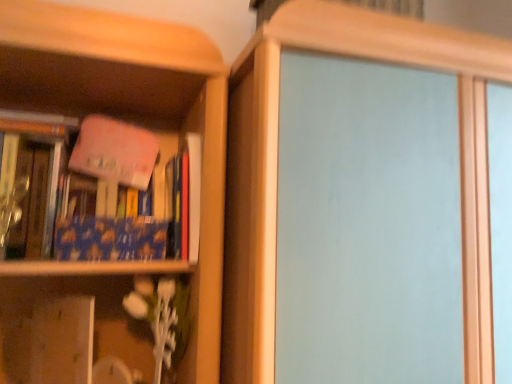
Question: Can we say blue matte book at left, which ranks as the 1th book in left-to-right order, lies outside transparent glass screen door at center?

Choices:
 (A) no
 (B) yes

Answer: (B)

Question: From the image's perspective, does blue matte book at left, which ranks as the 1th book in left-to-right order, appear lower than transparent glass screen door at center?

Choices:
 (A) no
 (B) yes

Answer: (A)

Question: Is blue matte book at left, which ranks as the 1th book in left-to-right order, far from transparent glass screen door at center?

Choices:
 (A) no
 (B) yes

Answer: (A)

Question: Is blue matte book at left, which ranks as the 1th book in left-to-right order, at the left side of transparent glass screen door at center?

Choices:
 (A) no
 (B) yes

Answer: (B)

Question: Considering the relative positions of blue matte book at left, which is counted as the second book, starting from the right, and transparent glass screen door at center in the image provided, is blue matte book at left, which is counted as the second book, starting from the right, in front of transparent glass screen door at center?

Choices:
 (A) yes
 (B) no

Answer: (B)

Question: Is blue matte book at left, which ranks as the 1th book in left-to-right order, wider or thinner than pink matte book at upper left, which is counted as the first book, starting from the right?

Choices:
 (A) wide
 (B) thin

Answer: (B)

Question: From the image's perspective, is blue matte book at left, which is counted as the second book, starting from the right, positioned above or below pink matte book at upper left, which is counted as the second book, starting from the left?

Choices:
 (A) above
 (B) below

Answer: (B)

Question: Is blue matte book at left, which is counted as the second book, starting from the right, to the left or to the right of pink matte book at upper left, which is counted as the first book, starting from the right, in the image?

Choices:
 (A) left
 (B) right

Answer: (A)

Question: Based on their sizes in the image, would you say blue matte book at left, which ranks as the 1th book in left-to-right order, is bigger or smaller than pink matte book at upper left, which is counted as the second book, starting from the left?

Choices:
 (A) big
 (B) small

Answer: (B)

Question: Considering the positions of wooden vase at lower left and transparent glass screen door at center in the image, is wooden vase at lower left bigger or smaller than transparent glass screen door at center?

Choices:
 (A) small
 (B) big

Answer: (A)

Question: Relative to transparent glass screen door at center, is wooden vase at lower left in front or behind?

Choices:
 (A) front
 (B) behind

Answer: (B)

Question: From the image's perspective, is wooden vase at lower left positioned above or below transparent glass screen door at center?

Choices:
 (A) below
 (B) above

Answer: (A)

Question: Is wooden vase at lower left to the left or to the right of transparent glass screen door at center in the image?

Choices:
 (A) right
 (B) left

Answer: (B)

Question: Is blue matte book at left, which is counted as the second book, starting from the right, taller or shorter than transparent glass screen door at center?

Choices:
 (A) tall
 (B) short

Answer: (B)

Question: Considering their positions, is blue matte book at left, which is counted as the second book, starting from the right, located in front of or behind transparent glass screen door at center?

Choices:
 (A) behind
 (B) front

Answer: (A)